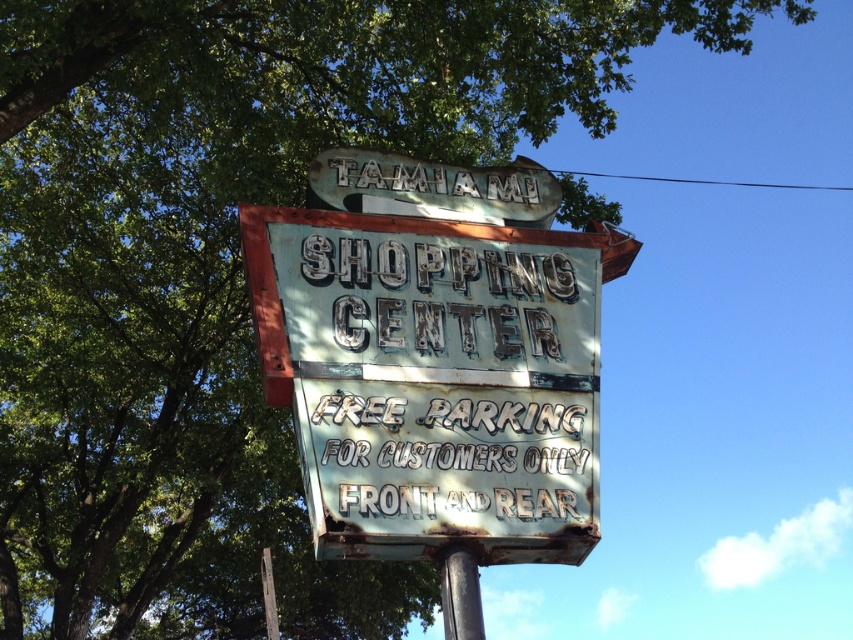
Does rusty metal sign at center appear on the right side of rusty metal pole at lower center?

No, rusty metal sign at center is not to the right of rusty metal pole at lower center.

Is rusty metal sign at center thinner than rusty metal pole at lower center?

No, rusty metal sign at center is not thinner than rusty metal pole at lower center.

Find the location of `rusty metal sign at center`. rusty metal sign at center is located at coordinates (432, 380).